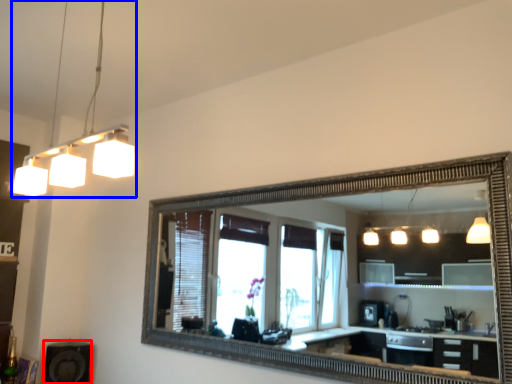
Question: Which object is closer to the camera taking this photo, speaker (highlighted by a red box) or light fixture (highlighted by a blue box)?

Choices:
 (A) speaker
 (B) light fixture

Answer: (B)